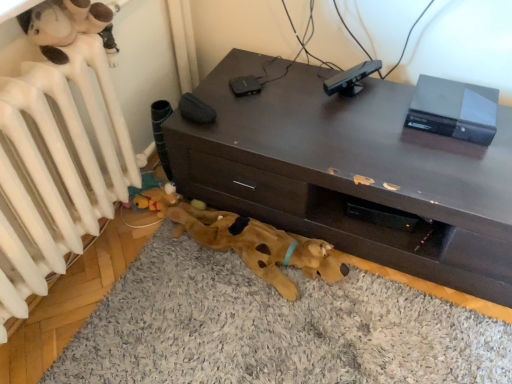
I want to click on vacant space to the right of black matte sensor at upper center, so pyautogui.click(x=390, y=89).